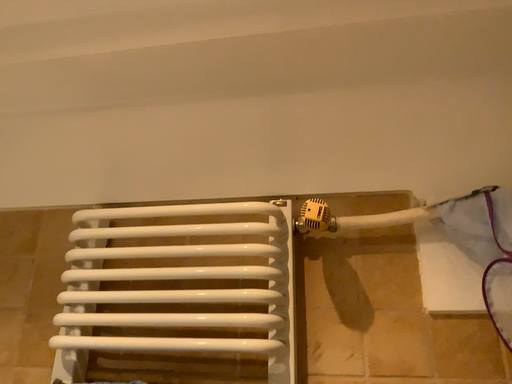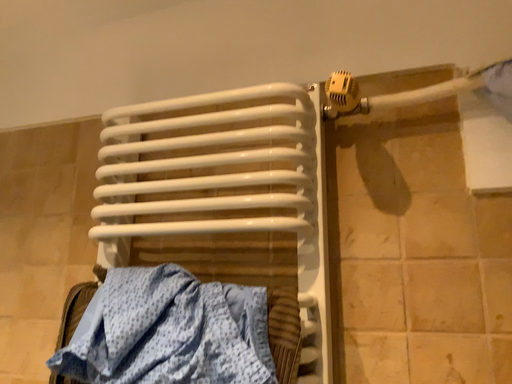
Question: How did the camera likely rotate when shooting the video?

Choices:
 (A) rotated left
 (B) rotated right

Answer: (A)